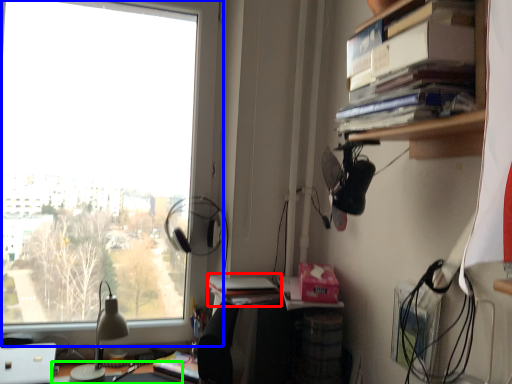
Question: Which object is positioned farthest from book (highlighted by a red box)? Select from window (highlighted by a blue box) and desk (highlighted by a green box).

Choices:
 (A) window
 (B) desk

Answer: (A)